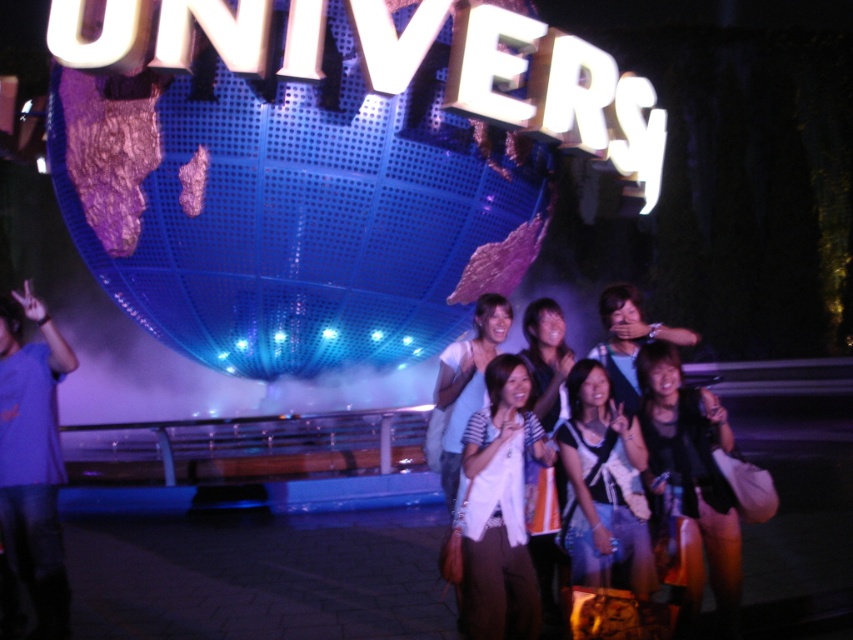
Who is positioned more to the left, black leather jacket at center or denim jacket at center?

denim jacket at center is more to the left.

Which of these two, black leather jacket at center or denim jacket at center, stands shorter?

denim jacket at center is shorter.

Locate an element on the screen. The image size is (853, 640). black leather jacket at center is located at coordinates (693, 481).

Where is `black leather jacket at center`? black leather jacket at center is located at coordinates (693, 481).

Is white fabric at center above denim jacket at center?

Incorrect, white fabric at center is not positioned above denim jacket at center.

Identify the location of white fabric at center. The width and height of the screenshot is (853, 640). (498, 508).

Is point (537, 429) positioned in front of point (641, 461)?

That is False.

The image size is (853, 640). In order to click on white fabric at center in this screenshot , I will do `click(498, 508)`.

In the scene shown: Does white fabric at center appear on the right side of black leather jacket at center?

Incorrect, white fabric at center is not on the right side of black leather jacket at center.

Between white fabric at center and black leather jacket at center, which one appears on the left side from the viewer's perspective?

white fabric at center

Is point (502, 609) less distant than point (698, 396)?

Yes, it is.

In order to click on white fabric at center in this screenshot , I will do `click(498, 508)`.